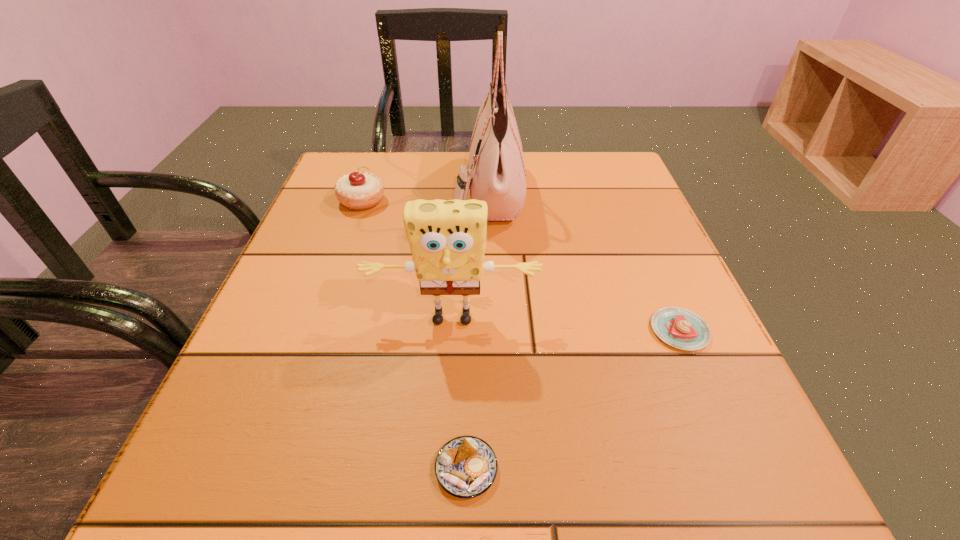
You are a GUI agent. You are given a task and a screenshot of the screen. Output one action in this format:
    pyautogui.click(x=<x>, y=<y>)
    Task: Click on the unoccupied position between the second tallest object and the second farthest pastry
    
    Given the screenshot: What is the action you would take?
    pyautogui.click(x=565, y=325)

Find the location of a particular element. vacant space in between the handbag and the farthest pastry is located at coordinates (425, 196).

Identify the location of free space between the rightmost pastry and the nearest pastry. (573, 400).

I want to click on free space between the sponge and the nearest object, so click(459, 394).

Where is `vacant area that lies between the sponge and the second pastry from right to left`? The image size is (960, 540). vacant area that lies between the sponge and the second pastry from right to left is located at coordinates (459, 394).

Locate which object is the closest to the rightmost object. Please provide its 2D coordinates. Your answer should be formatted as a tuple, i.e. [(x, y)], where the tuple contains the x and y coordinates of a point satisfying the conditions above.

[(447, 238)]

Locate which object is the fourth closest to the tallest pastry. Please provide its 2D coordinates. Your answer should be formatted as a tuple, i.e. [(x, y)], where the tuple contains the x and y coordinates of a point satisfying the conditions above.

[(680, 328)]

Choose which pastry is the nearest neighbor to the tallest object. Please provide its 2D coordinates. Your answer should be formatted as a tuple, i.e. [(x, y)], where the tuple contains the x and y coordinates of a point satisfying the conditions above.

[(363, 190)]

You are a GUI agent. You are given a task and a screenshot of the screen. Output one action in this format:
    pyautogui.click(x=<x>, y=<y>)
    Task: Click on the pastry object that ranks as the closest to the rightmost object
    
    Given the screenshot: What is the action you would take?
    pos(466,466)

You are a GUI agent. You are given a task and a screenshot of the screen. Output one action in this format:
    pyautogui.click(x=<x>, y=<y>)
    Task: Click on the free location that satisfies the following two spatial constraints: 1. on the face of the rightmost pastry; 2. on the right side of the fourth shortest object
    
    Given the screenshot: What is the action you would take?
    click(x=451, y=330)